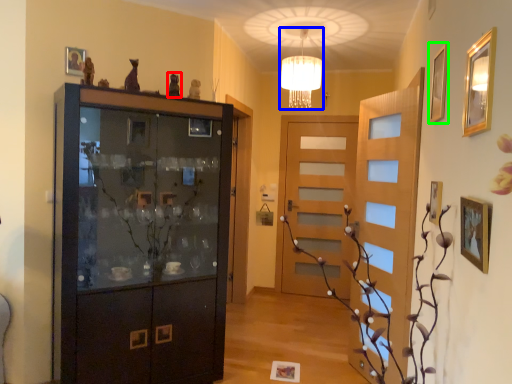
Question: Which object is the closest to the art (highlighted by a red box)? Choose among these: lamp (highlighted by a blue box) or picture frame (highlighted by a green box).

Choices:
 (A) lamp
 (B) picture frame

Answer: (A)